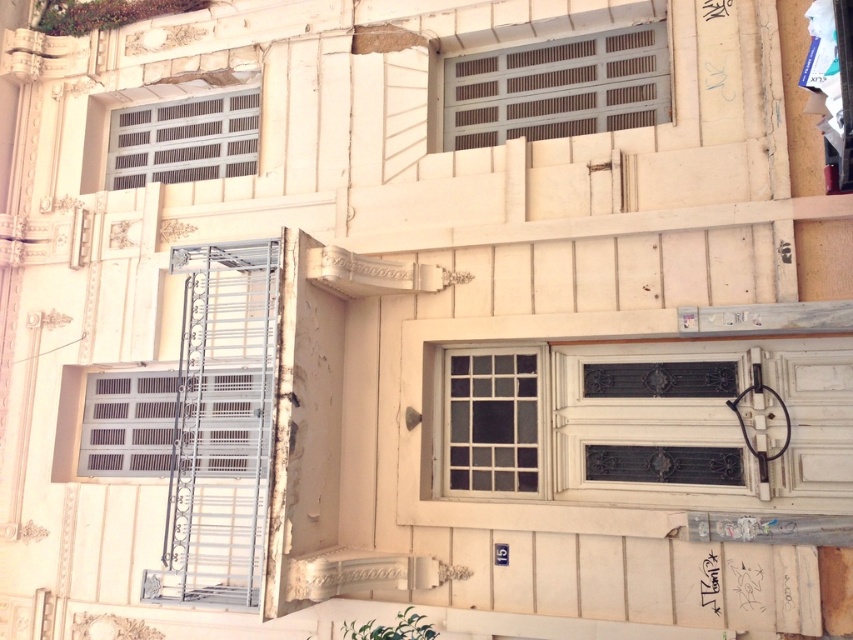
You are standing in front of the building and want to locate the white glass window at center. According to the coordinates provided, where exactly is it positioned?

The white glass window at center is located at point 0.658 on the x axis and 0.579 on the y axis.

You are an architect inspecting the building facade. You notice the metallic gray window at upper center and the metallic gray shutter at upper center. Which object would cast a larger shadow during midday when the sun is directly overhead?

The metallic gray window at upper center is bigger than the metallic gray shutter at upper center, so it would cast a larger shadow during midday when the sun is directly overhead.